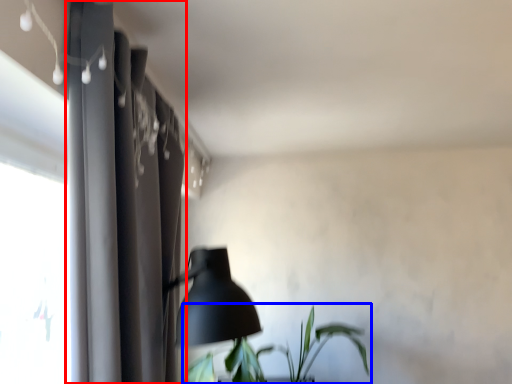
Question: Which point is further to the camera, curtain (highlighted by a red box) or houseplant (highlighted by a blue box)?

Choices:
 (A) curtain
 (B) houseplant

Answer: (B)